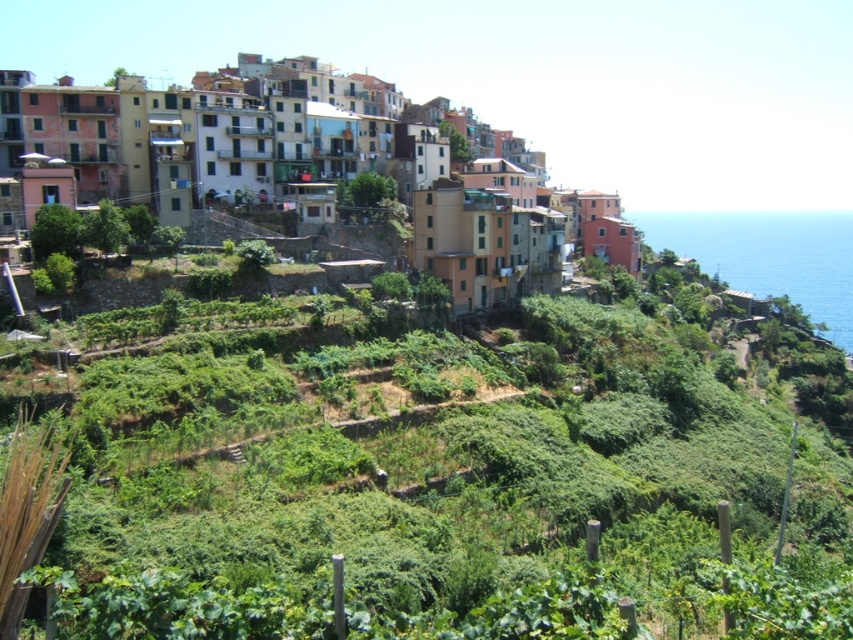
Does multicolored stone buildings at upper center have a lesser height compared to blue liquid water at right?

Indeed, multicolored stone buildings at upper center has a lesser height compared to blue liquid water at right.

Does multicolored stone buildings at upper center have a smaller size compared to blue liquid water at right?

Indeed, multicolored stone buildings at upper center has a smaller size compared to blue liquid water at right.

Between point (61, 144) and point (834, 241), which one is positioned behind?

The point (834, 241) is more distant.

The image size is (853, 640). I want to click on multicolored stone buildings at upper center, so click(x=234, y=134).

Measure the distance between green leafy plants at center and camera.

A distance of 33.08 meters exists between green leafy plants at center and camera.

Is point (239, 556) more distant than point (325, 104)?

No, it is not.

Which is behind, point (734, 484) or point (138, 179)?

The point (138, 179) is behind.

This screenshot has width=853, height=640. In order to click on green leafy plants at center in this screenshot , I will do `click(438, 486)`.

Does green leafy plants at center have a lesser width compared to blue liquid water at right?

Indeed, green leafy plants at center has a lesser width compared to blue liquid water at right.

Which of these two, green leafy plants at center or blue liquid water at right, stands taller?

With more height is blue liquid water at right.

Which is behind, point (796, 598) or point (747, 289)?

The point (747, 289) is behind.

You are a GUI agent. You are given a task and a screenshot of the screen. Output one action in this format:
    pyautogui.click(x=<x>, y=<y>)
    Task: Click on the green leafy plants at center
    The image size is (853, 640).
    Given the screenshot: What is the action you would take?
    pyautogui.click(x=438, y=486)